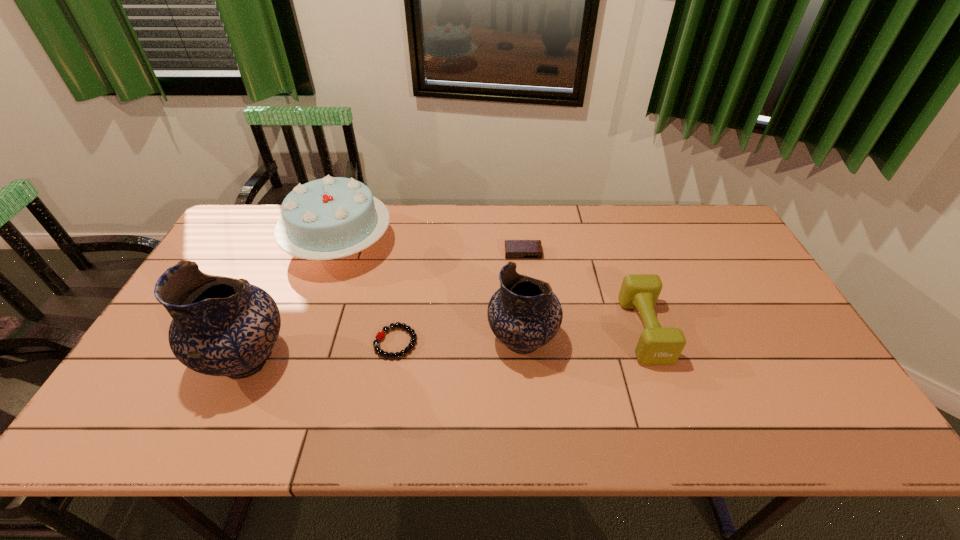
The width and height of the screenshot is (960, 540). What are the coordinates of `the left pottery` in the screenshot? It's located at (221, 326).

At what (x,y) coordinates should I click in order to perform the action: click on the tallest object. Please return your answer as a coordinate pair (x, y). Image resolution: width=960 pixels, height=540 pixels. Looking at the image, I should click on [x=221, y=326].

Identify the location of the right pottery. (524, 314).

At what (x,y) coordinates should I click in order to perform the action: click on birthday cake. Please return your answer as a coordinate pair (x, y). Image resolution: width=960 pixels, height=540 pixels. Looking at the image, I should click on pyautogui.click(x=333, y=217).

Where is `the fifth tallest object`? The width and height of the screenshot is (960, 540). the fifth tallest object is located at coordinates (514, 249).

At what (x,y) coordinates should I click in order to perform the action: click on the shortest object. Please return your answer as a coordinate pair (x, y). Looking at the image, I should click on (380, 335).

At what (x,y) coordinates should I click in order to perform the action: click on bracelet. Please return your answer as a coordinate pair (x, y). The width and height of the screenshot is (960, 540). Looking at the image, I should click on (380, 335).

The height and width of the screenshot is (540, 960). I want to click on dumbbell, so click(x=657, y=346).

At what (x,y) coordinates should I click in order to perform the action: click on the fourth tallest object. Please return your answer as a coordinate pair (x, y). Looking at the image, I should click on (657, 346).

Find the location of a particular element. This screenshot has width=960, height=540. vacant area situated 0.200m on the back of the taller pottery is located at coordinates (287, 272).